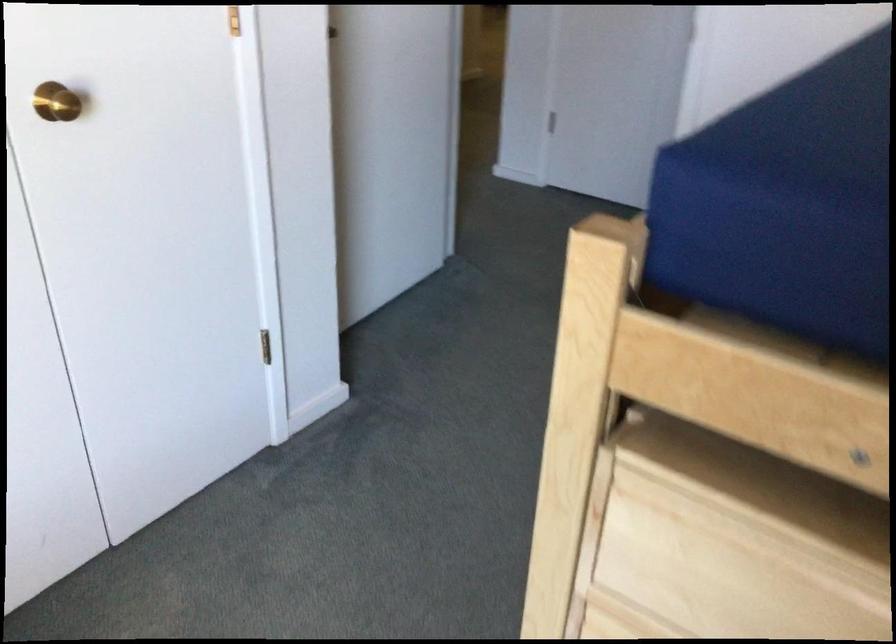
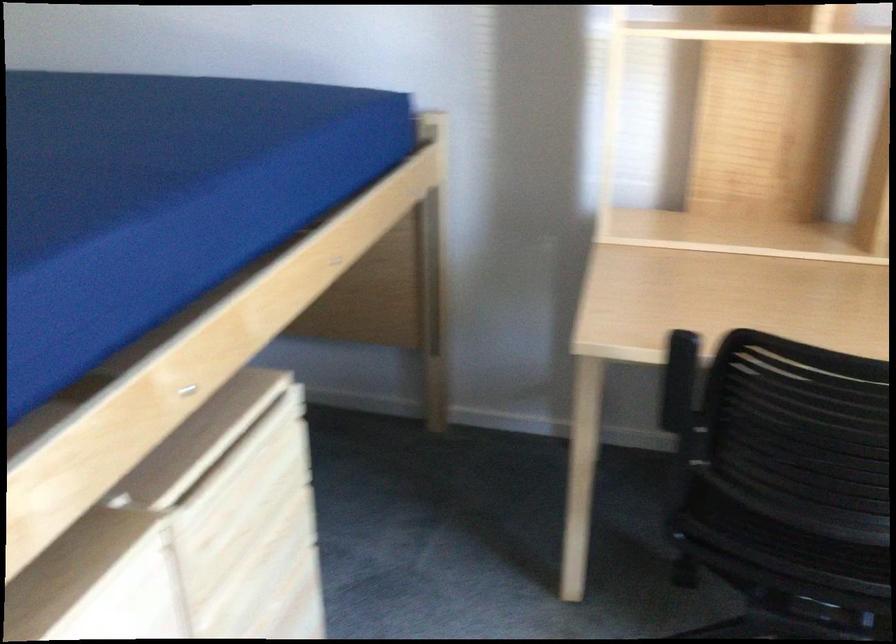
First-person continuous shooting, in which direction is the camera rotating?

The camera rotated toward right-down.